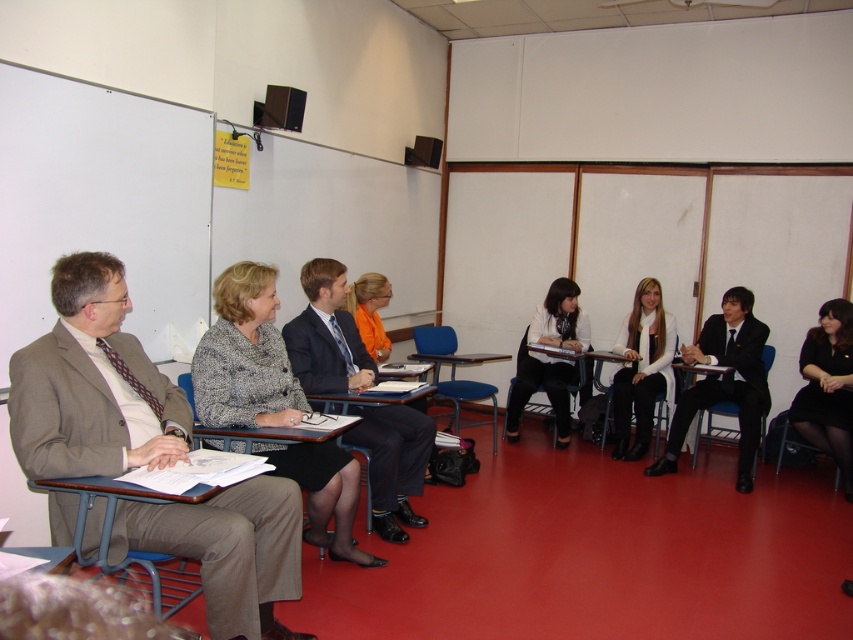
Question: Which object appears farthest from the camera in this image?

Choices:
 (A) metallic blue chair at right
 (B) blue plastic chair at center

Answer: (A)

Question: Does dark blue suit at center have a greater width compared to orange fabric jacket at center?

Choices:
 (A) yes
 (B) no

Answer: (A)

Question: Does patterned fabric jacket at center appear on the right side of matte black desk at center?

Choices:
 (A) no
 (B) yes

Answer: (A)

Question: Does light brown suit at left lie behind patterned fabric jacket at center?

Choices:
 (A) yes
 (B) no

Answer: (B)

Question: Which of the following is the closest to the observer?

Choices:
 (A) white matte scarf at center
 (B) blue plastic chair at center
 (C) wooden desk at center
 (D) orange fabric jacket at center

Answer: (D)

Question: Estimate the real-world distances between objects in this image. Which object is farther from the black suit at center?

Choices:
 (A) wooden desk at center
 (B) patterned fabric jacket at center
 (C) black satin dress at lower right
 (D) matte black desk at center

Answer: (B)